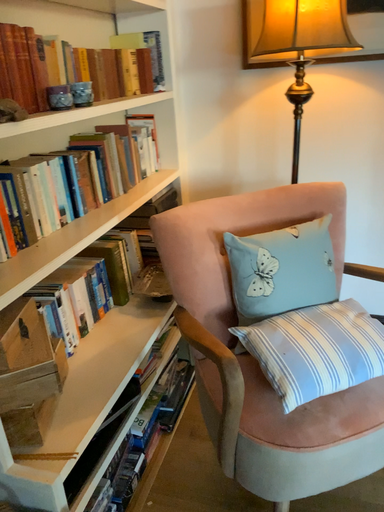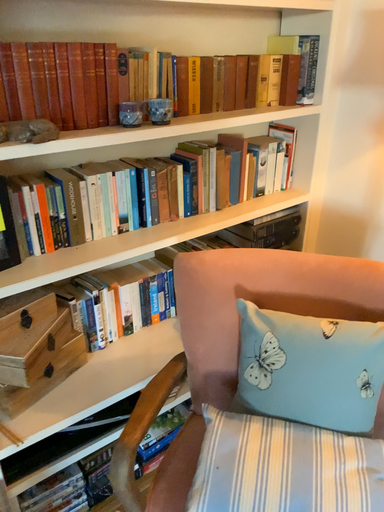
Question: How did the camera likely rotate when shooting the video?

Choices:
 (A) rotated left
 (B) rotated right

Answer: (A)